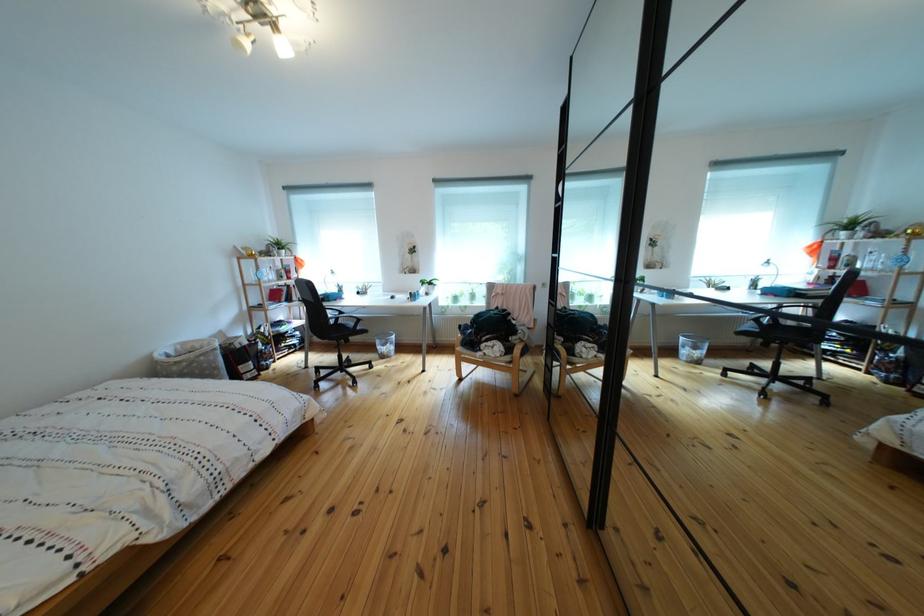
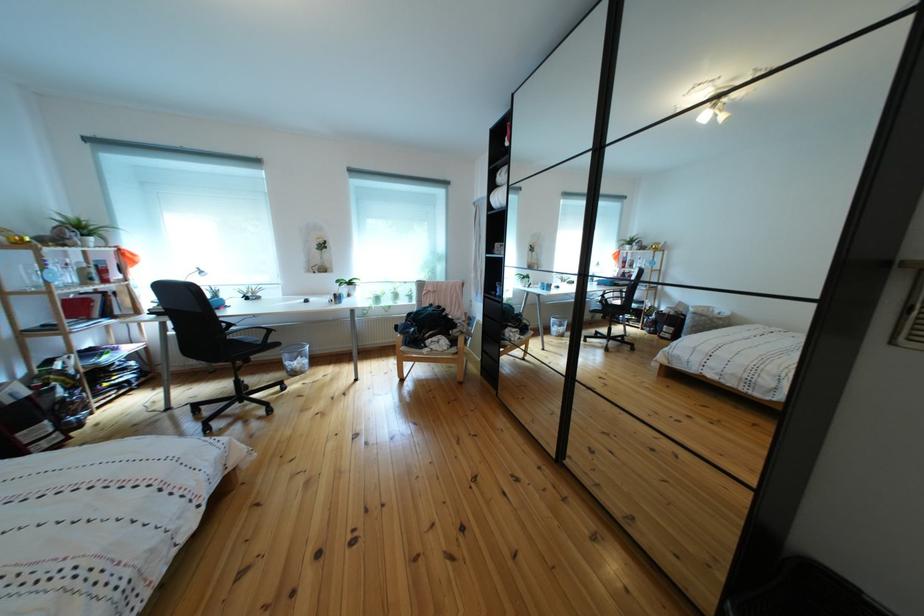
Locate, in the second image, the point that corresponds to (x=434, y=288) in the first image.

(351, 288)